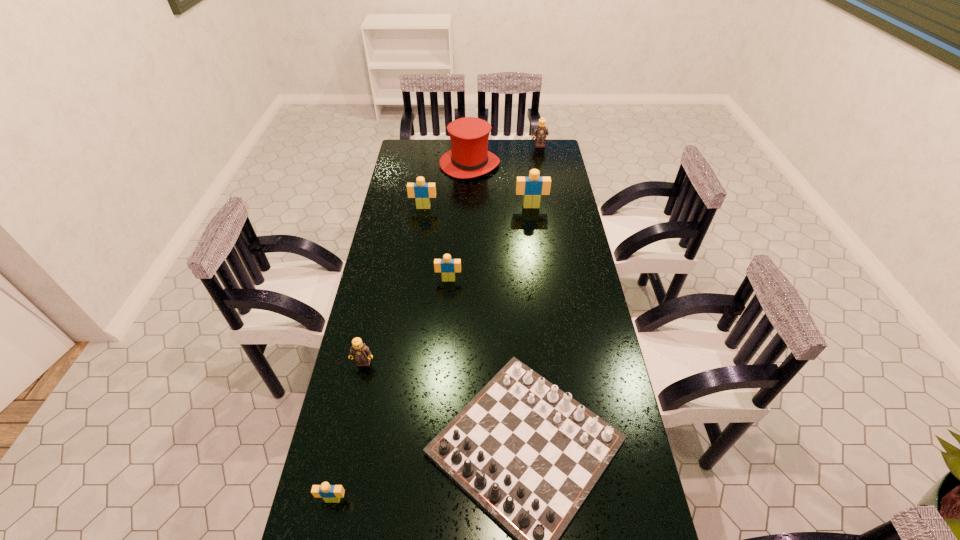
Where is `the nearer tan Lego`? The width and height of the screenshot is (960, 540). the nearer tan Lego is located at coordinates (359, 351).

Find the location of a particular element. The width and height of the screenshot is (960, 540). the left tan Lego is located at coordinates (359, 351).

At what (x,y) coordinates should I click in order to perform the action: click on the smallest beige Lego. Please return your answer as a coordinate pair (x, y). Image resolution: width=960 pixels, height=540 pixels. Looking at the image, I should click on (330, 493).

The image size is (960, 540). I want to click on the leftmost beige Lego, so click(x=330, y=493).

Identify the location of vacant area situated 0.210m on the front of the second farthest object. (468, 209).

Locate an element on the screen. The height and width of the screenshot is (540, 960). vacant region located 0.160m on the face of the biggest beige Lego is located at coordinates (535, 233).

Find the location of a particular element. The height and width of the screenshot is (540, 960). vacant space located on the face of the second beige Lego from left to right is located at coordinates (416, 258).

This screenshot has height=540, width=960. Find the location of `vacant area situated 0.220m in front of the bigger tan Lego`. vacant area situated 0.220m in front of the bigger tan Lego is located at coordinates (544, 171).

Identify the location of free location located on the face of the second nearest beige Lego. The width and height of the screenshot is (960, 540). (443, 364).

I want to click on free space located 0.290m in front of the left tan Lego, so click(x=343, y=461).